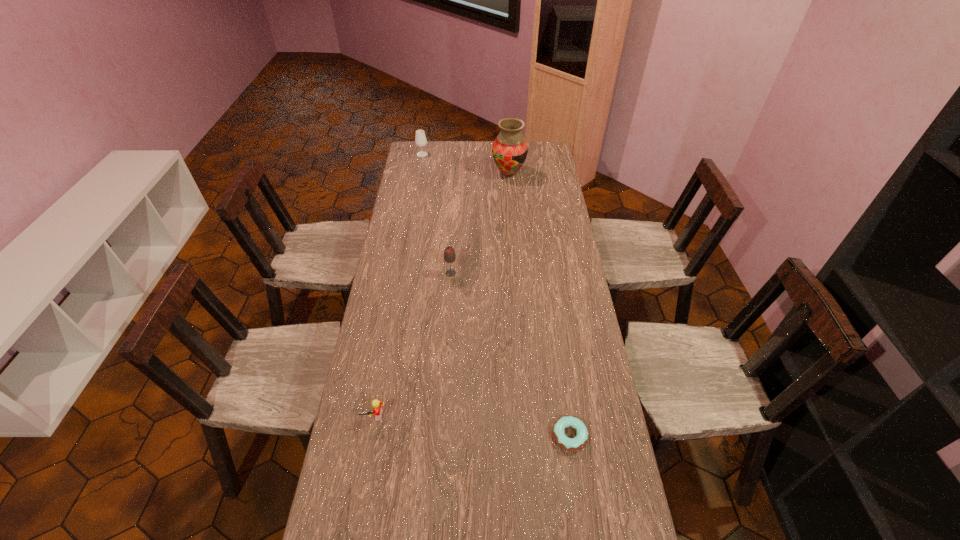
Where is `object present at the far right corner`? This screenshot has width=960, height=540. object present at the far right corner is located at coordinates (510, 149).

Identify the location of vacant space at the far edge. (446, 148).

Where is `free spot at the left edge of the desktop`? This screenshot has height=540, width=960. free spot at the left edge of the desktop is located at coordinates (425, 214).

This screenshot has height=540, width=960. I want to click on vacant space at the right edge, so click(x=587, y=489).

Image resolution: width=960 pixels, height=540 pixels. Find the location of `free spot between the third nearest object and the Lego`. free spot between the third nearest object and the Lego is located at coordinates (413, 345).

Where is `empty space between the fourth nearest object and the right glass drink container`? This screenshot has width=960, height=540. empty space between the fourth nearest object and the right glass drink container is located at coordinates (480, 223).

I want to click on blank region between the farther glass drink container and the shortest object, so click(x=496, y=295).

Where is `vacant region between the farthest object and the shortest object`? The height and width of the screenshot is (540, 960). vacant region between the farthest object and the shortest object is located at coordinates (496, 295).

You are a GUI agent. You are given a task and a screenshot of the screen. Output one action in this format:
    pyautogui.click(x=<x>, y=<y>)
    Task: Click on the vacant region between the fourth tallest object and the fourth nearest object
    This screenshot has height=540, width=960.
    Given the screenshot: What is the action you would take?
    pyautogui.click(x=442, y=295)

You are a GUI agent. You are given a task and a screenshot of the screen. Output one action in this format:
    pyautogui.click(x=<x>, y=<y>)
    Task: Click on the free space that is in between the second shortest object and the second farthest object
    The width and height of the screenshot is (960, 540).
    Given the screenshot: What is the action you would take?
    pyautogui.click(x=442, y=295)